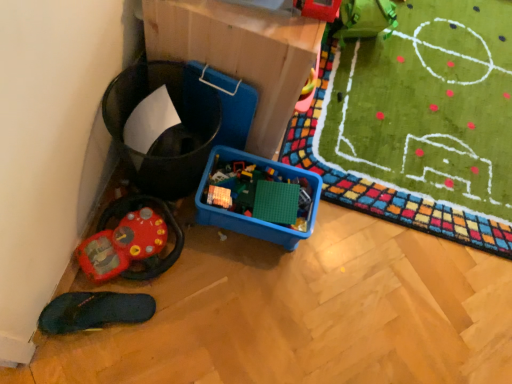
What is the approximate height of black rubber slipper at lower left?

black rubber slipper at lower left is 3.92 inches in height.

The height and width of the screenshot is (384, 512). What do you see at coordinates (94, 311) in the screenshot?
I see `black rubber slipper at lower left` at bounding box center [94, 311].

Describe the element at coordinates (318, 9) in the screenshot. I see `rubberized plastic toy at upper right, marked as the 1th toy in a top-to-bottom arrangement` at that location.

What is the approximate height of cardboard at upper center?

cardboard at upper center is 21.11 inches in height.

How much space does rubberized red steering wheel at lower left, which is the 1th toy from bottom to top, occupy horizontally?

It is 10.80 inches.

The height and width of the screenshot is (384, 512). I want to click on black rubber slipper at lower left, so click(x=94, y=311).

From a real-world perspective, which object rests below the other?

In real-world perspective, black rubber slipper at lower left is lower.

Which is behind, point (335, 13) or point (85, 326)?

Point (85, 326)

In the scene shown: Is rubberized plastic toy at upper right, marked as the 2th toy in a left-to-right arrangement, in front of or behind black rubber slipper at lower left in the image?

rubberized plastic toy at upper right, marked as the 2th toy in a left-to-right arrangement, is in front of black rubber slipper at lower left.

Are rubberized plastic toy at upper right, which is the 1th toy in right-to-left order, and black rubber slipper at lower left beside each other?

rubberized plastic toy at upper right, which is the 1th toy in right-to-left order, and black rubber slipper at lower left are not in contact.

Is rubberized red steering wheel at lower left, which is the 1th toy from bottom to top, bigger than rubberized plastic toy at upper right, acting as the 2th toy starting from the back?

Correct, rubberized red steering wheel at lower left, which is the 1th toy from bottom to top, is larger in size than rubberized plastic toy at upper right, acting as the 2th toy starting from the back.

Is rubberized red steering wheel at lower left, which appears as the second toy when viewed from the right, directly adjacent to rubberized plastic toy at upper right, the second toy from the bottom?

There is a gap between rubberized red steering wheel at lower left, which appears as the second toy when viewed from the right, and rubberized plastic toy at upper right, the second toy from the bottom.

Is rubberized red steering wheel at lower left, the 1th toy viewed from the left, inside the boundaries of rubberized plastic toy at upper right, the first toy in the front-to-back sequence, or outside?

rubberized red steering wheel at lower left, the 1th toy viewed from the left, exists outside the volume of rubberized plastic toy at upper right, the first toy in the front-to-back sequence.

Looking at this image, from the image's perspective, is rubberized red steering wheel at lower left, which appears as the first toy when viewed from the back, on top of rubberized plastic toy at upper right, the second toy from the bottom?

No, from the image's perspective, rubberized red steering wheel at lower left, which appears as the first toy when viewed from the back, is not over rubberized plastic toy at upper right, the second toy from the bottom.

Considering the sizes of objects black rubber slipper at lower left and rubberized plastic toy at upper right, acting as the 2th toy starting from the back, in the image provided, who is bigger, black rubber slipper at lower left or rubberized plastic toy at upper right, acting as the 2th toy starting from the back,?

rubberized plastic toy at upper right, acting as the 2th toy starting from the back, is bigger.

Is black rubber slipper at lower left positioned far away from rubberized plastic toy at upper right, which is the 1th toy in right-to-left order?

black rubber slipper at lower left is near rubberized plastic toy at upper right, which is the 1th toy in right-to-left order, not far away.

From a real-world perspective, between black rubber slipper at lower left and rubberized plastic toy at upper right, marked as the 1th toy in a top-to-bottom arrangement, who is vertically lower?

black rubber slipper at lower left.

Is black rubber slipper at lower left facing away from rubberized plastic toy at upper right, the first toy in the front-to-back sequence?

No.

Is rubberized red steering wheel at lower left, which appears as the first toy when viewed from the back, further to camera compared to black rubber slipper at lower left?

That is True.

You are a GUI agent. You are given a task and a screenshot of the screen. Output one action in this format:
    pyautogui.click(x=<x>, y=<y>)
    Task: Click on the footwear below the rubberized red steering wheel at lower left, acting as the 2th toy starting from the front (from the image's perspective)
    
    Given the screenshot: What is the action you would take?
    pyautogui.click(x=94, y=311)

From a real-world perspective, relative to black rubber slipper at lower left, is rubberized red steering wheel at lower left, which appears as the second toy when viewed from the right, vertically above or below?

rubberized red steering wheel at lower left, which appears as the second toy when viewed from the right, is situated higher than black rubber slipper at lower left in the real world.

Considering the relative positions of rubberized red steering wheel at lower left, acting as the 2th toy starting from the front, and black rubber slipper at lower left in the image provided, is rubberized red steering wheel at lower left, acting as the 2th toy starting from the front, to the right of black rubber slipper at lower left from the viewer's perspective?

Correct, you'll find rubberized red steering wheel at lower left, acting as the 2th toy starting from the front, to the right of black rubber slipper at lower left.

Consider the image. Can you confirm if cardboard at upper center is thinner than rubberized red steering wheel at lower left, the 1th toy viewed from the left?

No, cardboard at upper center is not thinner than rubberized red steering wheel at lower left, the 1th toy viewed from the left.

In the scene shown: From a real-world perspective, which is physically below, cardboard at upper center or rubberized red steering wheel at lower left, which appears as the second toy when viewed from the top?

rubberized red steering wheel at lower left, which appears as the second toy when viewed from the top, is physically lower.

Is cardboard at upper center outside of rubberized red steering wheel at lower left, acting as the 2th toy starting from the front?

Yes.

Is cardboard at upper center smaller than rubberized red steering wheel at lower left, the 1th toy viewed from the left?

No, cardboard at upper center is not smaller than rubberized red steering wheel at lower left, the 1th toy viewed from the left.

Does point (123, 322) lie in front of point (135, 250)?

Yes.

Which of these two, black rubber slipper at lower left or rubberized red steering wheel at lower left, which appears as the first toy when viewed from the back, is wider?

With larger width is black rubber slipper at lower left.

Considering the sizes of black rubber slipper at lower left and rubberized red steering wheel at lower left, which appears as the first toy when viewed from the back, in the image, is black rubber slipper at lower left bigger or smaller than rubberized red steering wheel at lower left, which appears as the first toy when viewed from the back,?

In the image, black rubber slipper at lower left appears to be smaller than rubberized red steering wheel at lower left, which appears as the first toy when viewed from the back.

How many degrees apart are the facing directions of black rubber slipper at lower left and rubberized red steering wheel at lower left, the 1th toy viewed from the left?

32.1 degrees.

Is rubberized plastic toy at upper right, the second toy from the bottom, not within rubberized red steering wheel at lower left, which appears as the second toy when viewed from the right?

Absolutely, rubberized plastic toy at upper right, the second toy from the bottom, is external to rubberized red steering wheel at lower left, which appears as the second toy when viewed from the right.

Considering the relative sizes of rubberized plastic toy at upper right, which is the 1th toy in right-to-left order, and rubberized red steering wheel at lower left, which appears as the second toy when viewed from the right, in the image provided, is rubberized plastic toy at upper right, which is the 1th toy in right-to-left order, wider than rubberized red steering wheel at lower left, which appears as the second toy when viewed from the right,?

No.

From a real-world perspective, is rubberized plastic toy at upper right, the first toy in the front-to-back sequence, physically located above or below rubberized red steering wheel at lower left, which is the 1th toy from bottom to top?

In terms of real-world spatial position, rubberized plastic toy at upper right, the first toy in the front-to-back sequence, is above rubberized red steering wheel at lower left, which is the 1th toy from bottom to top.

Is rubberized plastic toy at upper right, marked as the 1th toy in a top-to-bottom arrangement, aimed at rubberized red steering wheel at lower left, acting as the 2th toy starting from the front?

No, rubberized plastic toy at upper right, marked as the 1th toy in a top-to-bottom arrangement, is not aimed at rubberized red steering wheel at lower left, acting as the 2th toy starting from the front.

Identify the location of footwear that appears below the rubberized plastic toy at upper right, marked as the 1th toy in a top-to-bottom arrangement (from a real-world perspective). The image size is (512, 384). (94, 311).

This screenshot has height=384, width=512. Identify the location of toy located above the rubberized red steering wheel at lower left, which appears as the first toy when viewed from the back (from a real-world perspective). (318, 9).

Estimate the real-world distances between objects in this image. Which object is closer to rubberized plastic toy at upper right, marked as the 2th toy in a left-to-right arrangement, cardboard at upper center or rubberized red steering wheel at lower left, acting as the 2th toy starting from the front?

Based on the image, cardboard at upper center appears to be nearer to rubberized plastic toy at upper right, marked as the 2th toy in a left-to-right arrangement.

Looking at this image, estimate the real-world distances between objects in this image. Which object is further from rubberized plastic toy at upper right, marked as the 1th toy in a top-to-bottom arrangement, rubberized red steering wheel at lower left, the 1th toy viewed from the left, or black rubber slipper at lower left?

The object further to rubberized plastic toy at upper right, marked as the 1th toy in a top-to-bottom arrangement, is black rubber slipper at lower left.

Looking at the image, which one is located further to black rubber slipper at lower left, cardboard at upper center or rubberized plastic toy at upper right, acting as the 2th toy starting from the back?

rubberized plastic toy at upper right, acting as the 2th toy starting from the back, is positioned further to the anchor black rubber slipper at lower left.

When comparing their distances from black rubber slipper at lower left, does rubberized plastic toy at upper right, the second toy from the bottom, or rubberized red steering wheel at lower left, acting as the 2th toy starting from the front, seem further?

The object further to black rubber slipper at lower left is rubberized plastic toy at upper right, the second toy from the bottom.

When comparing their distances from rubberized red steering wheel at lower left, acting as the 2th toy starting from the front, does cardboard at upper center or black rubber slipper at lower left seem further?

The object further to rubberized red steering wheel at lower left, acting as the 2th toy starting from the front, is cardboard at upper center.

From the image, which object appears to be nearer to cardboard at upper center, rubberized red steering wheel at lower left, which appears as the second toy when viewed from the top, or rubberized plastic toy at upper right, acting as the 2th toy starting from the back?

The object closer to cardboard at upper center is rubberized plastic toy at upper right, acting as the 2th toy starting from the back.

Which object lies further to the anchor point cardboard at upper center, rubberized plastic toy at upper right, marked as the 2th toy in a left-to-right arrangement, or black rubber slipper at lower left?

black rubber slipper at lower left.

Based on their spatial positions, is cardboard at upper center or rubberized red steering wheel at lower left, which appears as the second toy when viewed from the top, closer to black rubber slipper at lower left?

rubberized red steering wheel at lower left, which appears as the second toy when viewed from the top, is closer to black rubber slipper at lower left.

Where is `toy between cardboard at upper center and rubberized red steering wheel at lower left, acting as the 2th toy starting from the front, in the vertical direction`? Image resolution: width=512 pixels, height=384 pixels. toy between cardboard at upper center and rubberized red steering wheel at lower left, acting as the 2th toy starting from the front, in the vertical direction is located at coordinates (318, 9).

The image size is (512, 384). What are the coordinates of `toy between rubberized plastic toy at upper right, which is the 1th toy in right-to-left order, and black rubber slipper at lower left, in the vertical direction` in the screenshot? It's located at (132, 240).